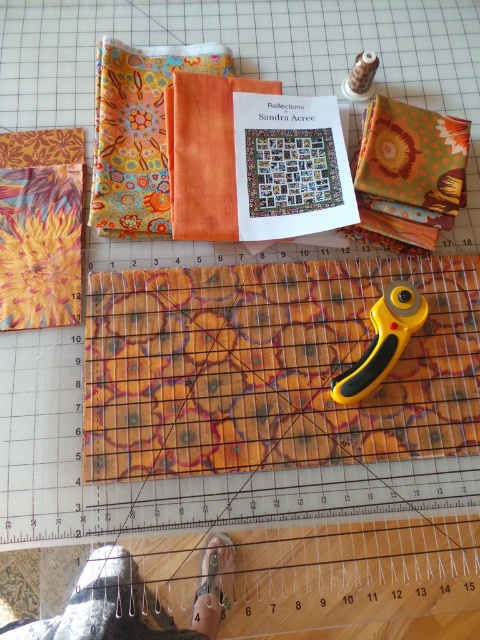
Question: Which object is closer to the camera taking this photo?

Choices:
 (A) orange cotton fabric at center
 (B) floral batik fabric at center

Answer: (A)

Question: Estimate the real-world distances between objects in this image. Which object is farther from the orange batik fabric at lower center?

Choices:
 (A) yellow plastic rotary cutter at center
 (B) floral batik fabric at center
 (C) orange cotton fabric at center

Answer: (B)

Question: Is orange cotton fabric at center above orange batik fabric at lower center?

Choices:
 (A) no
 (B) yes

Answer: (B)

Question: Can you confirm if floral batik fabric at center is smaller than orange cotton fabric at center?

Choices:
 (A) no
 (B) yes

Answer: (A)

Question: Is floral batik fabric at center to the right of orange batik fabric at lower center from the viewer's perspective?

Choices:
 (A) no
 (B) yes

Answer: (A)

Question: Which point is closer to the camera taking this photo?

Choices:
 (A) (106, 586)
 (B) (186, 129)
 (C) (132, 202)

Answer: (A)